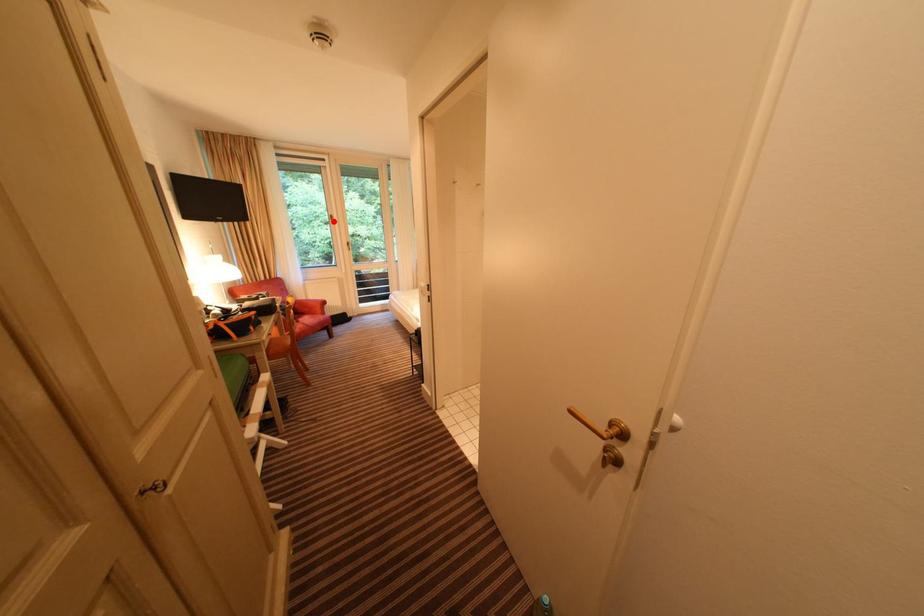
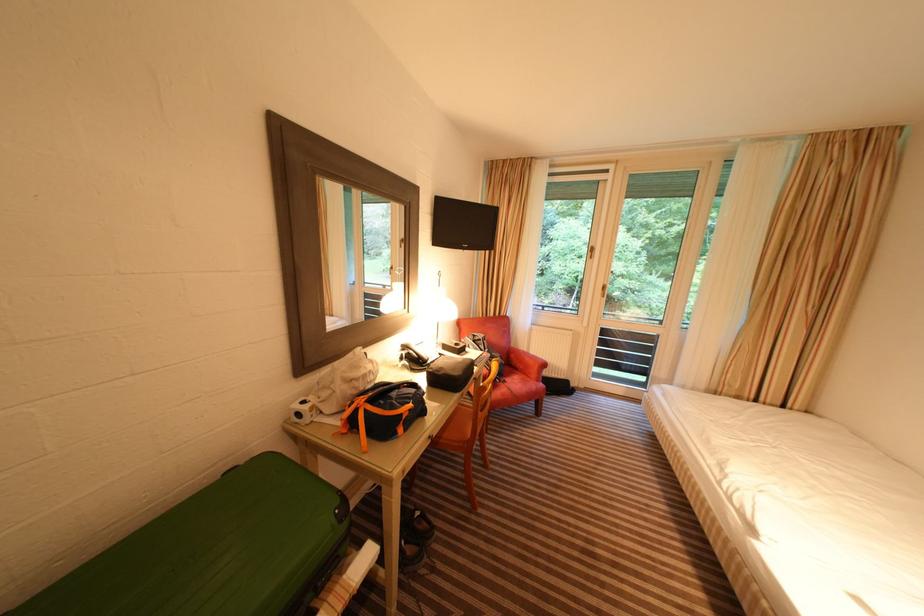
Question: I am providing you with two images of the same scene from different viewpoints. In image1, a red point is highlighted. Considering the same 3D point in image2, which of the following is correct?

Choices:
 (A) It is closer
 (B) It is farther

Answer: (B)